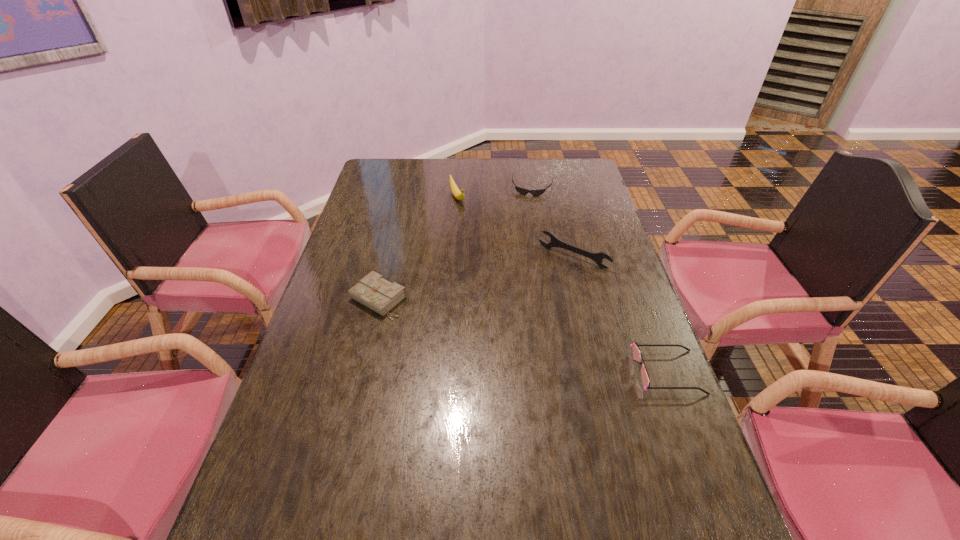
Find the location of a particular element. This screenshot has height=540, width=960. vacant area located on the back of the second nearest object is located at coordinates (386, 267).

Identify the location of vacant region located 0.380m at the stem of the fourth object from right to left. (500, 273).

This screenshot has width=960, height=540. I want to click on vacant space located at the stem of the fourth object from right to left, so click(464, 215).

Identify the location of free space located at the stem of the fourth object from right to left. The width and height of the screenshot is (960, 540). (472, 230).

Where is `vacant space located 0.090m on the open ends of the wrench`? vacant space located 0.090m on the open ends of the wrench is located at coordinates (543, 286).

At what (x,y) coordinates should I click in order to perform the action: click on free space located 0.280m on the open ends of the wrench. Please return your answer as a coordinate pair (x, y). Looking at the image, I should click on [x=511, y=326].

This screenshot has width=960, height=540. In order to click on vacant region located on the open ends of the wrench in this screenshot , I will do `click(540, 290)`.

Find the location of `free spot located 0.100m on the front-facing side of the shorter sunglasses`. free spot located 0.100m on the front-facing side of the shorter sunglasses is located at coordinates (527, 211).

In order to click on vacant area situated on the front-facing side of the shorter sunglasses in this screenshot , I will do `click(527, 209)`.

Where is `vacant region located on the front-facing side of the shorter sunglasses`? The image size is (960, 540). vacant region located on the front-facing side of the shorter sunglasses is located at coordinates (527, 207).